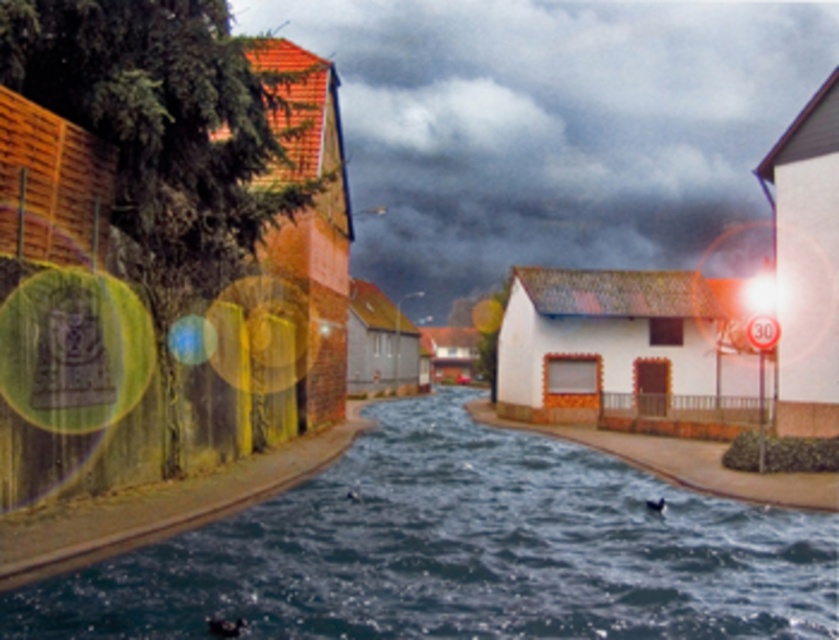
Does dark cloudy sky at upper center come in front of dark blue liquid at center?

No, dark cloudy sky at upper center is behind dark blue liquid at center.

Does dark cloudy sky at upper center appear over dark blue liquid at center?

Correct, dark cloudy sky at upper center is located above dark blue liquid at center.

Between point (550, 157) and point (605, 472), which one is positioned behind?

Positioned behind is point (550, 157).

I want to click on dark cloudy sky at upper center, so (x=551, y=128).